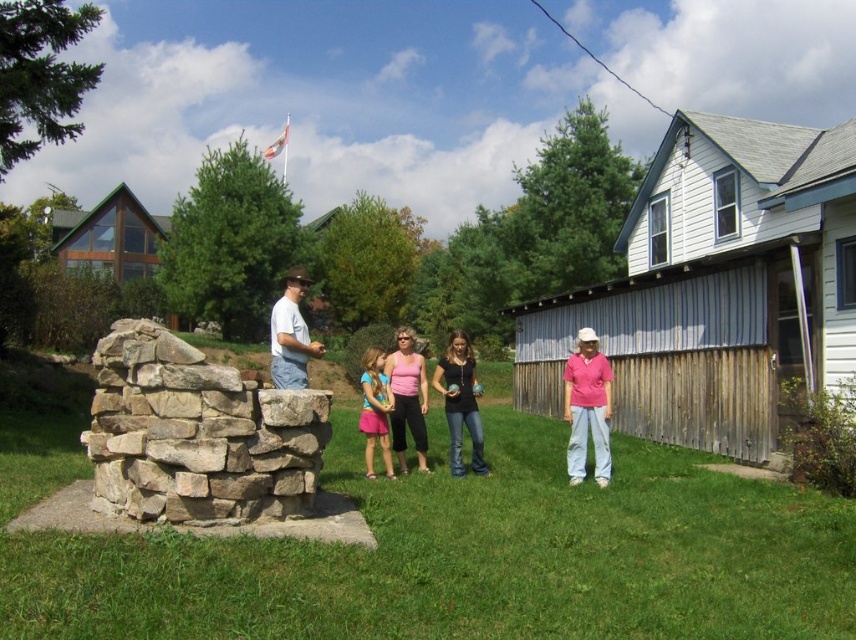
Question: Does natural stone fountain at center appear under denim jeans at center?

Choices:
 (A) no
 (B) yes

Answer: (A)

Question: Among these points, which one is farthest from the camera?

Choices:
 (A) (459, 403)
 (B) (104, 497)

Answer: (A)

Question: Which of these objects is positioned closest to the pink cotton shirt at center?

Choices:
 (A) denim jeans at center
 (B) pink fabric dress at center
 (C) white cotton shirt at center
 (D) natural stone fountain at center

Answer: (A)

Question: Among these points, which one is nearest to the camera?

Choices:
 (A) (458, 381)
 (B) (294, 282)
 (C) (383, 442)
 (D) (116, 461)

Answer: (D)

Question: Is natural stone fountain at center bigger than white cotton shirt at center?

Choices:
 (A) no
 (B) yes

Answer: (A)

Question: Can you confirm if denim jeans at center is bigger than pink fabric dress at center?

Choices:
 (A) no
 (B) yes

Answer: (B)